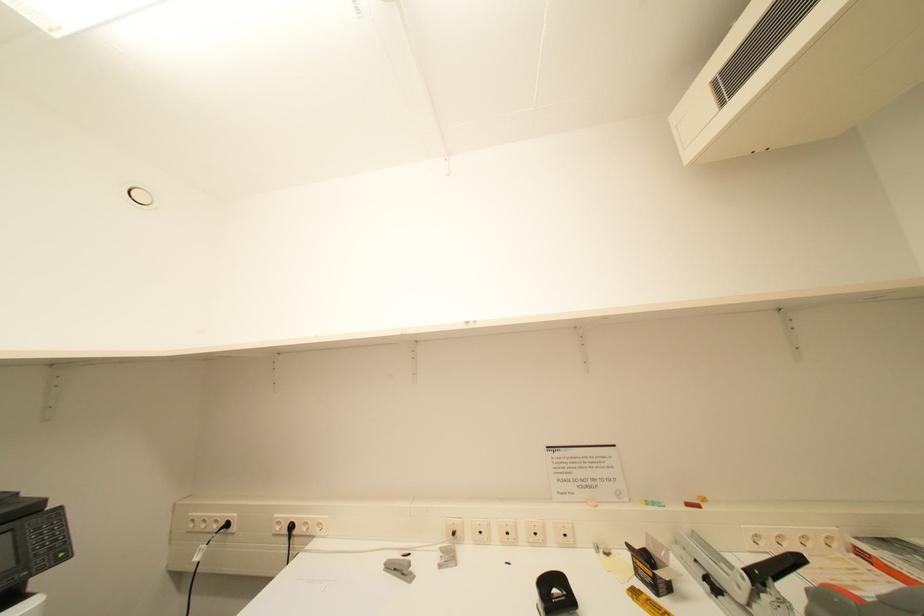
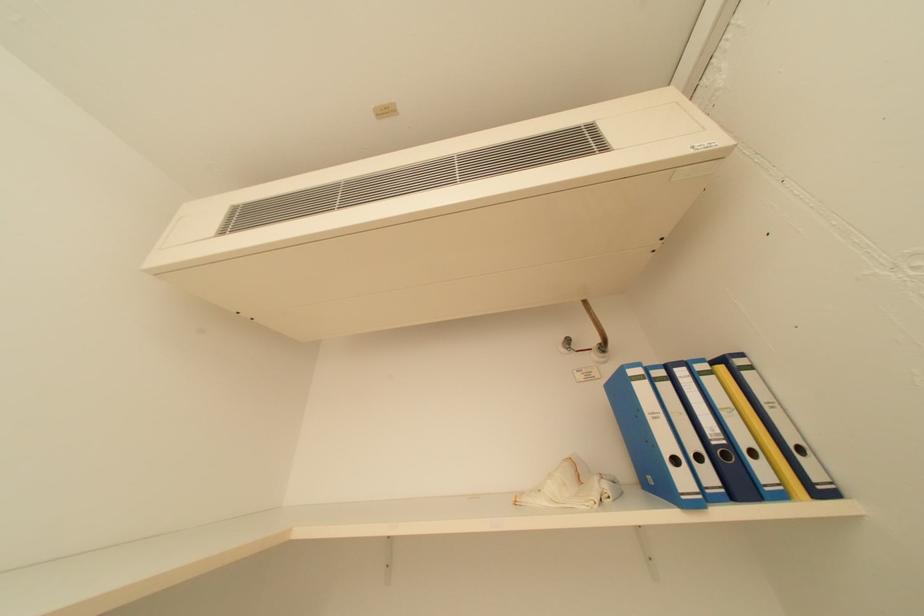
The first image is from the beginning of the video and the second image is from the end. How did the camera likely rotate when shooting the video?

The camera rotated toward right-up.